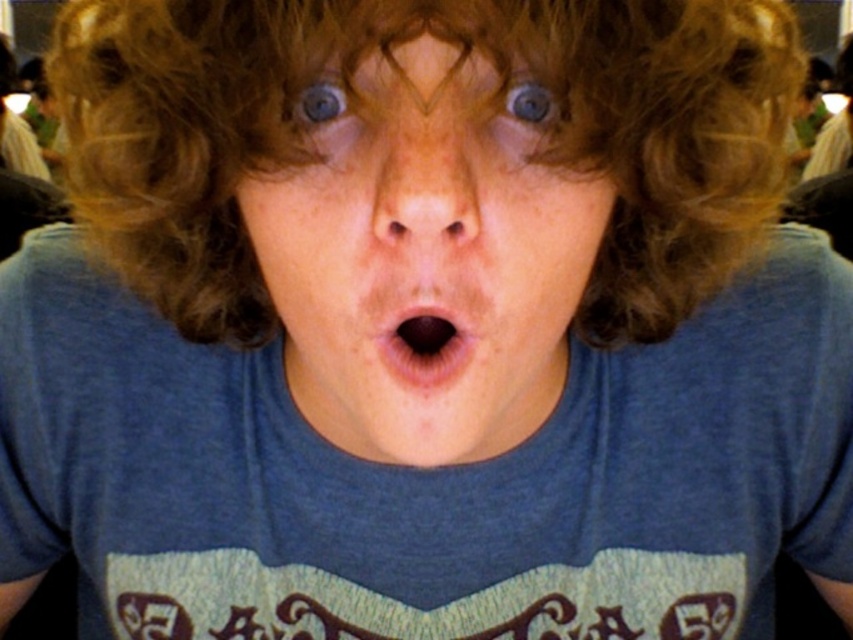
Measure the distance between blue matte face at center and camera.

11.52 inches

Does blue matte face at center appear on the right side of blue matte eye at upper center?

Incorrect, blue matte face at center is not on the right side of blue matte eye at upper center.

What do you see at coordinates (425, 260) in the screenshot? The image size is (853, 640). I see `blue matte face at center` at bounding box center [425, 260].

The height and width of the screenshot is (640, 853). I want to click on blue matte face at center, so click(x=425, y=260).

Which is above, blue matte face at center or blue glossy eye at upper center?

Positioned higher is blue glossy eye at upper center.

Does blue matte face at center appear under blue glossy eye at upper center?

Indeed, blue matte face at center is positioned under blue glossy eye at upper center.

Between point (457, 147) and point (296, 116), which one is positioned behind?

The point (296, 116) is more distant.

At what (x,y) coordinates should I click in order to perform the action: click on blue matte face at center. Please return your answer as a coordinate pair (x, y). Image resolution: width=853 pixels, height=640 pixels. Looking at the image, I should click on (425, 260).

Between dry skin nose at center and blue glossy eye at upper center, which one has less height?

Standing shorter between the two is blue glossy eye at upper center.

How distant is dry skin nose at center from blue glossy eye at upper center?

3.77 centimeters

Between point (468, 161) and point (312, 104), which one is positioned behind?

The point (312, 104) is more distant.

Where is `dry skin nose at center`? dry skin nose at center is located at coordinates (422, 173).